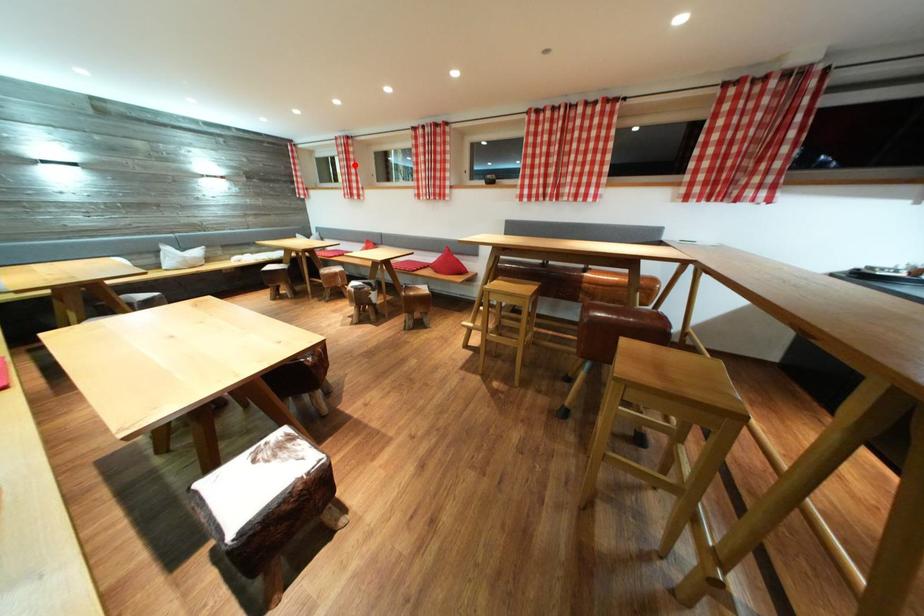
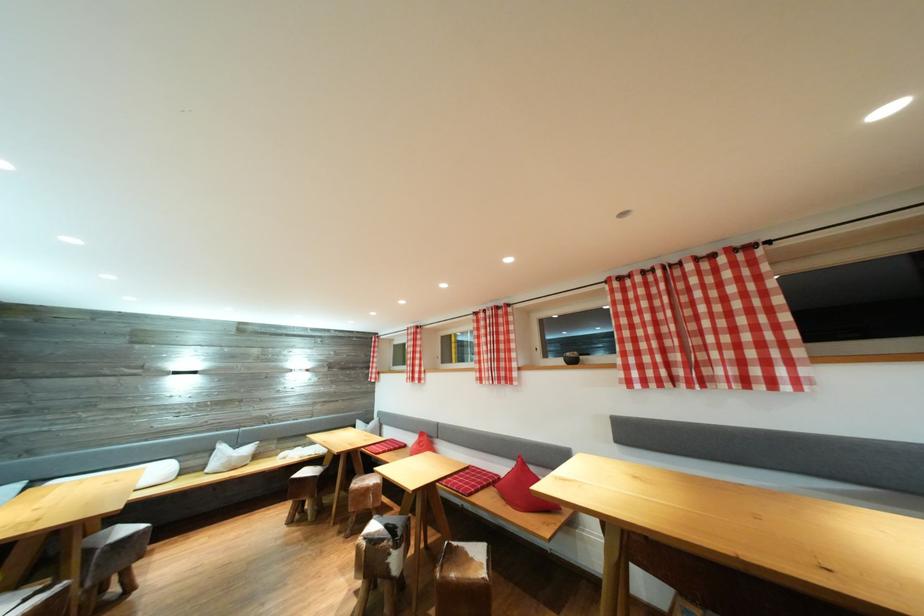
Question: A red point is marked in image1. In image2, is the corresponding 3D point closer to the camera or farther? Reply with the corresponding letter.

Choices:
 (A) The corresponding 3D point is closer.
 (B) The corresponding 3D point is farther.

Answer: (B)